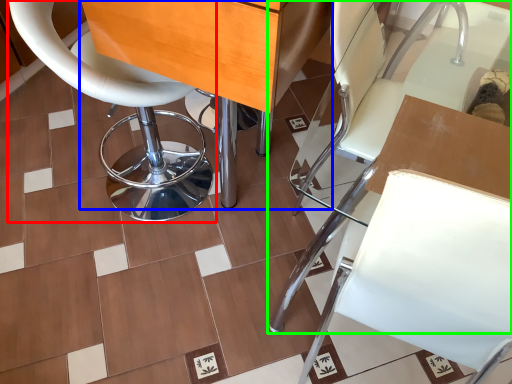
Question: Which object is the closest to the chair (highlighted by a red box)? Choose among these: table (highlighted by a blue box) or chair (highlighted by a green box).

Choices:
 (A) table
 (B) chair

Answer: (A)